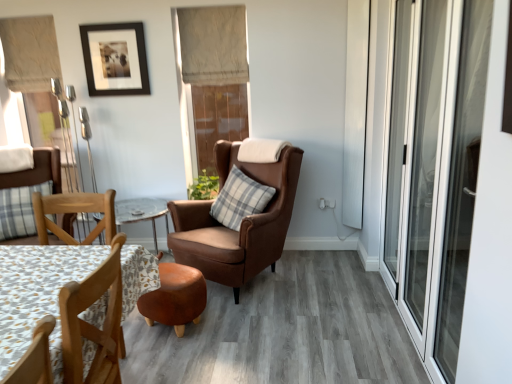
Question: Is beige fabric curtain at upper left, placed as the second curtain when sorted from right to left, completely or partially inside transparent glass screen door at right?

Choices:
 (A) no
 (B) yes

Answer: (A)

Question: Does transparent glass screen door at right have a larger size compared to beige fabric curtain at upper left, placed as the second curtain when sorted from right to left?

Choices:
 (A) no
 (B) yes

Answer: (B)

Question: Is transparent glass screen door at right oriented towards beige fabric curtain at upper left, placed as the second curtain when sorted from right to left?

Choices:
 (A) no
 (B) yes

Answer: (B)

Question: Can you see transparent glass screen door at right touching beige fabric curtain at upper left, placed as the second curtain when sorted from right to left?

Choices:
 (A) yes
 (B) no

Answer: (B)

Question: Is transparent glass screen door at right oriented away from beige fabric curtain at upper left, acting as the 1th curtain starting from the left?

Choices:
 (A) no
 (B) yes

Answer: (A)

Question: Based on their positions, is brown leather wingback chair at center, the 2th chair positioned from the left, located to the left or right of green leafy plant at center?

Choices:
 (A) right
 (B) left

Answer: (A)

Question: Based on their sizes in the image, would you say brown leather wingback chair at center, the 2th chair positioned from the left, is bigger or smaller than green leafy plant at center?

Choices:
 (A) small
 (B) big

Answer: (B)

Question: From a real-world perspective, is brown leather wingback chair at center, the first chair positioned from the right, positioned above or below green leafy plant at center?

Choices:
 (A) below
 (B) above

Answer: (A)

Question: In terms of width, does brown leather wingback chair at center, the first chair positioned from the right, look wider or thinner when compared to green leafy plant at center?

Choices:
 (A) wide
 (B) thin

Answer: (A)

Question: From a real-world perspective, relative to green leafy plant at center, is plaid fabric chair at lower left, placed as the 2th chair when sorted from right to left, vertically above or below?

Choices:
 (A) above
 (B) below

Answer: (A)

Question: Does point (64, 218) appear closer or farther from the camera than point (193, 183)?

Choices:
 (A) closer
 (B) farther

Answer: (A)

Question: Do you think plaid fabric chair at lower left, acting as the 1th chair starting from the left, is within green leafy plant at center, or outside of it?

Choices:
 (A) outside
 (B) inside

Answer: (A)

Question: Considering the positions of plaid fabric chair at lower left, acting as the 1th chair starting from the left, and green leafy plant at center in the image, is plaid fabric chair at lower left, acting as the 1th chair starting from the left, bigger or smaller than green leafy plant at center?

Choices:
 (A) small
 (B) big

Answer: (B)

Question: Is green leafy plant at center inside the boundaries of beige fabric curtain at upper center, the second curtain positioned from the left, or outside?

Choices:
 (A) outside
 (B) inside

Answer: (A)

Question: From the image's perspective, relative to beige fabric curtain at upper center, the second curtain positioned from the left, is green leafy plant at center above or below?

Choices:
 (A) below
 (B) above

Answer: (A)